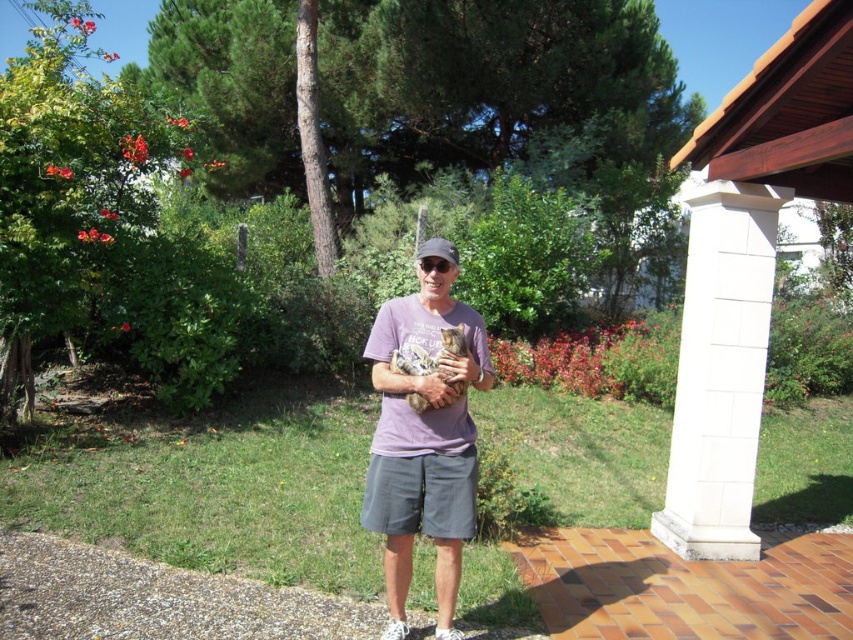
You are designing a layout for a new garden and need to place a statue that is 1.2 meters wide. You have two options for locations based on the scene described. The first location is where the white textured column at right is placed, and the second is where the gray cotton shorts at center are located. Which location can accommodate the statue without it exceeding the space?

The white textured column at right has a greater width than the gray cotton shorts at center. Since the statue is 1.2 meters wide, the location of the white textured column at right would be more suitable as it provides a wider space compared to the gray cotton shorts at center.

You are a tailor measuring the distance between the purple cotton shirt at center and the matte gray baseball cap at center for a custom fit. The minimum required distance for your measurements is 30 inches. Can you proceed with the measurements?

The purple cotton shirt at center is 32.10 inches from matte gray baseball cap at center, which exceeds the minimum required distance of 30 inches. Therefore, you can proceed with the measurements.